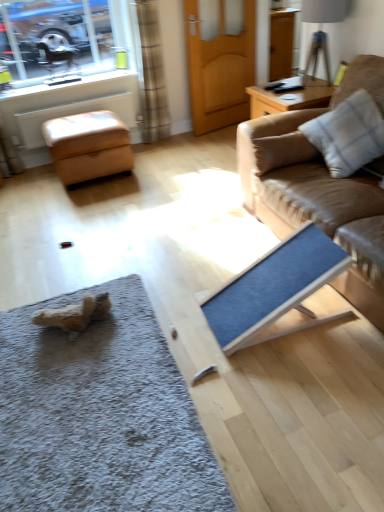
Where is `blank space to the left of leather couch at right`? blank space to the left of leather couch at right is located at coordinates (175, 237).